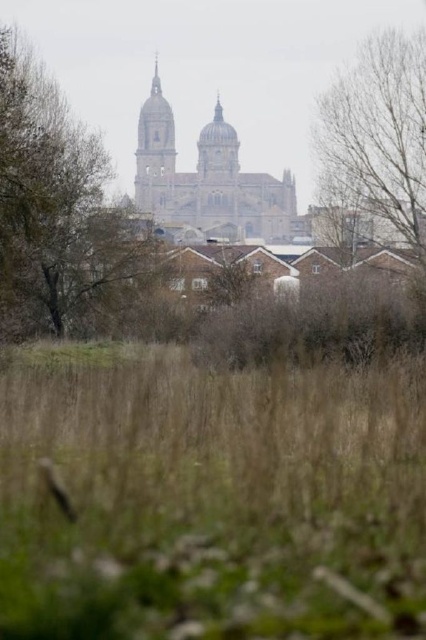
Question: Is brown grass at lower center further to the viewer compared to bare branches at upper center?

Choices:
 (A) yes
 (B) no

Answer: (B)

Question: Which of the following is the farthest from the observer?

Choices:
 (A) brown stone tower at center
 (B) brown grass at lower center

Answer: (A)

Question: Which of the following is the closest to the observer?

Choices:
 (A) (184, 195)
 (B) (62, 362)
 (C) (416, 42)

Answer: (B)

Question: Where is brown leafy tree at upper center located in relation to bare branches at upper center in the image?

Choices:
 (A) below
 (B) above

Answer: (A)

Question: Estimate the real-world distances between objects in this image. Which object is closer to the brown grass at lower center?

Choices:
 (A) brown stone tower at center
 (B) brown leafy tree at upper center
 (C) bare branches at upper center

Answer: (B)

Question: Can you confirm if brown grass at lower center is thinner than bare branches at upper center?

Choices:
 (A) no
 (B) yes

Answer: (A)